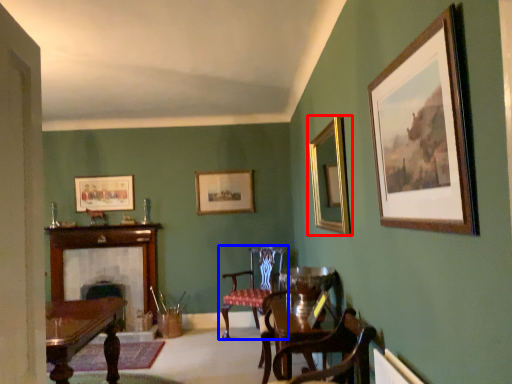
Question: Which object is closer to the camera taking this photo, picture frame (highlighted by a red box) or chair (highlighted by a blue box)?

Choices:
 (A) picture frame
 (B) chair

Answer: (A)